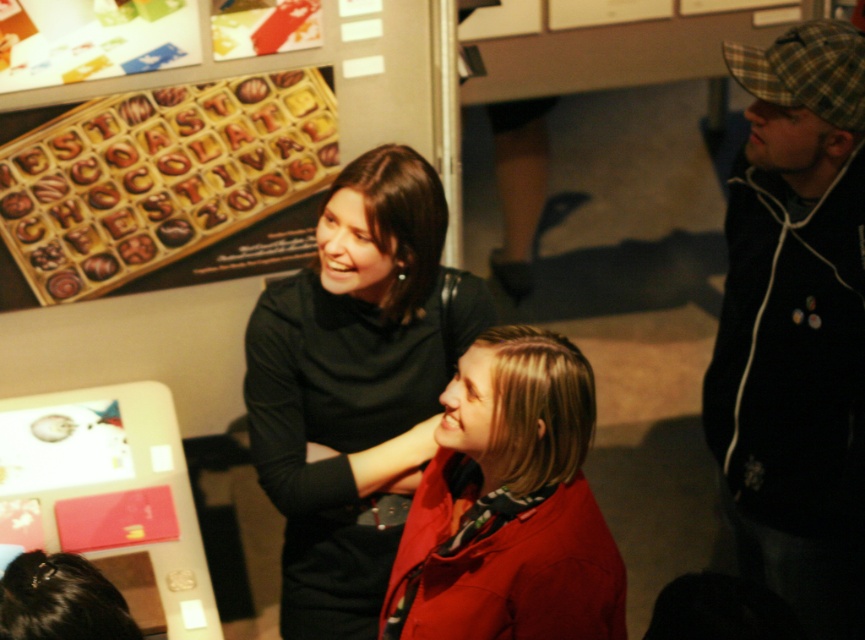
Question: Is black matte dress at center thinner than matte red coat at center?

Choices:
 (A) no
 (B) yes

Answer: (A)

Question: Among these points, which one is farthest from the camera?

Choices:
 (A) (383, 516)
 (B) (479, 630)
 (C) (833, 568)

Answer: (C)

Question: Can you confirm if plaid fabric cap at right is thinner than matte red coat at center?

Choices:
 (A) no
 (B) yes

Answer: (B)

Question: Which of the following is the farthest from the observer?

Choices:
 (A) matte red coat at center
 (B) plaid fabric cap at right

Answer: (B)

Question: Can you confirm if plaid fabric cap at right is positioned to the right of black matte dress at center?

Choices:
 (A) no
 (B) yes

Answer: (B)

Question: Which point is closer to the camera taking this photo?

Choices:
 (A) (321, 572)
 (B) (795, 364)

Answer: (B)